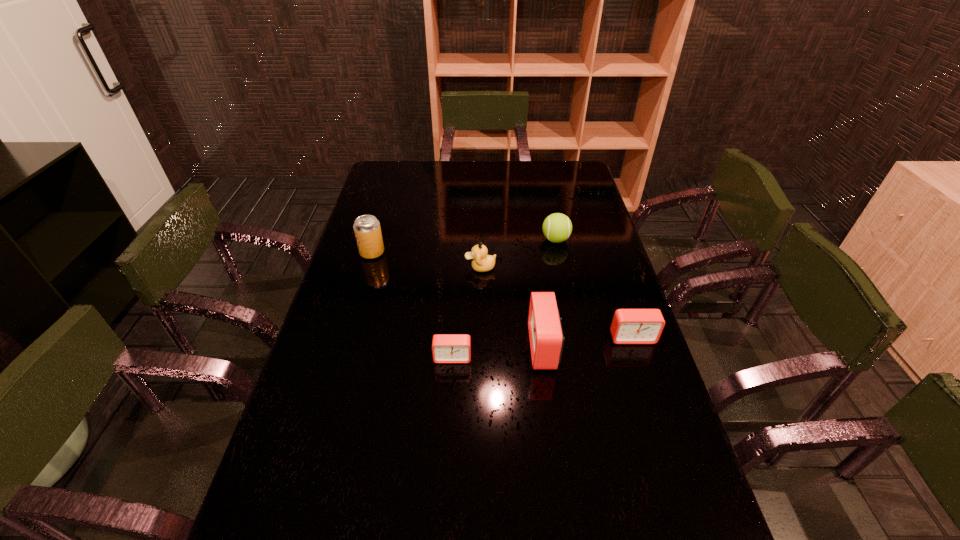
With all alarm clocks evenly spaced, where should an extra alarm clock be placed on the left to continue the pattern? Please point out a vacant space. Please provide its 2D coordinates. Your answer should be formatted as a tuple, i.e. [(x, y)], where the tuple contains the x and y coordinates of a point satisfying the conditions above.

[(356, 368)]